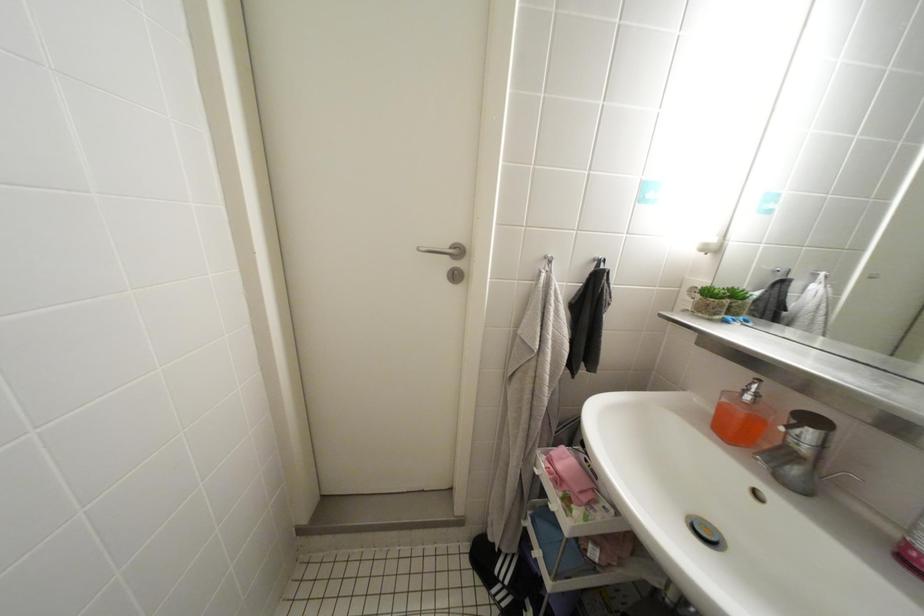
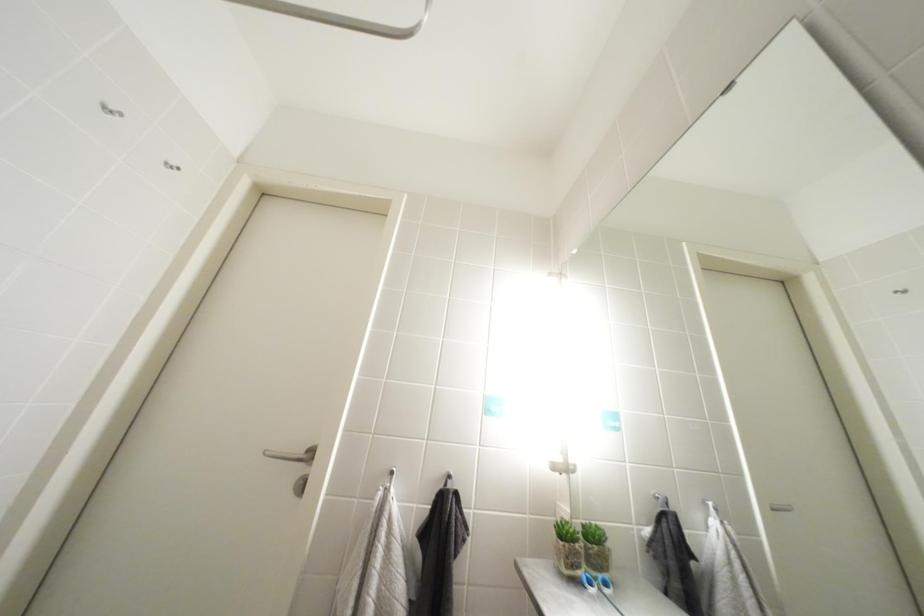
Question: Based on the continuous images, in which direction is the camera rotating? Reply with the corresponding letter.

Choices:
 (A) Left
 (B) Right
 (C) Up
 (D) Down

Answer: (C)